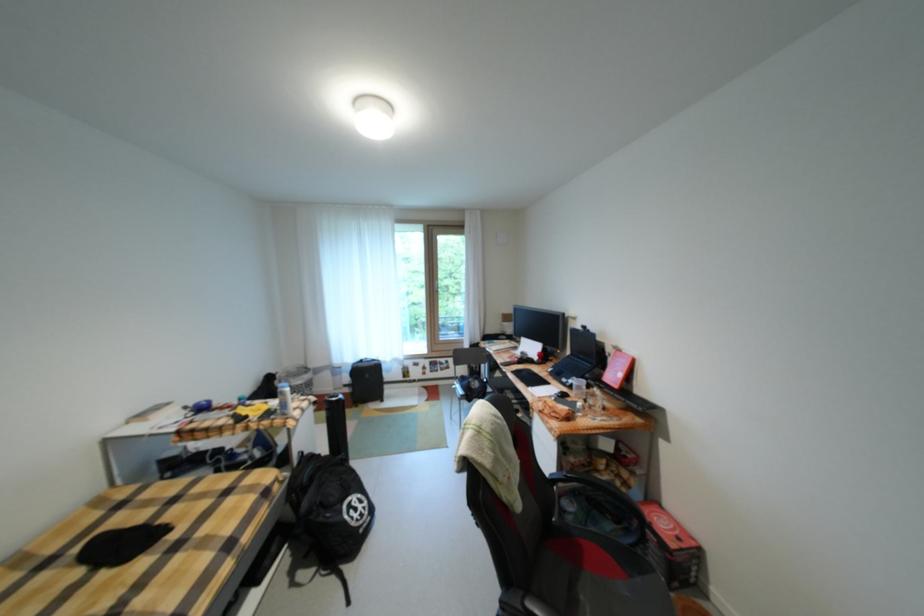
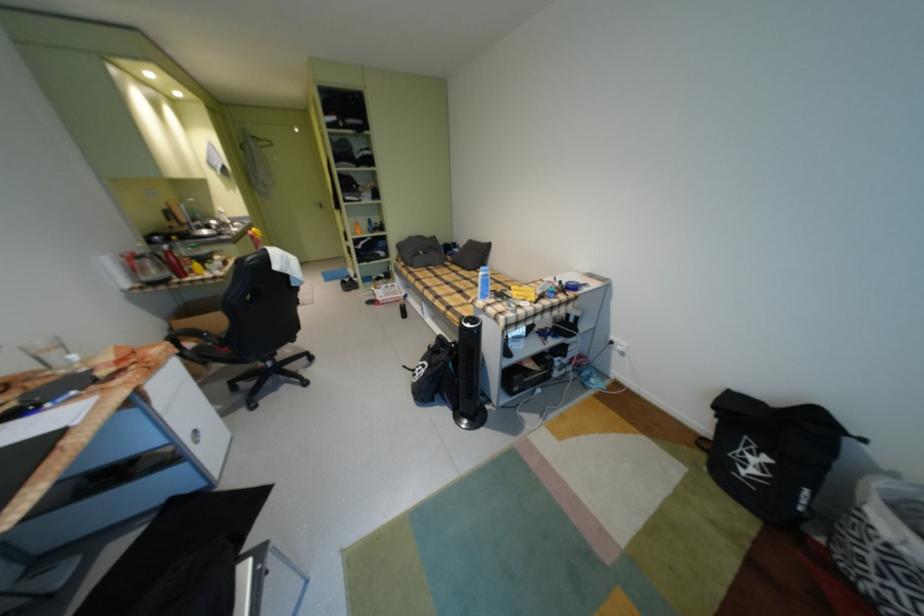
Question: I am providing you with two images of the same scene from different viewpoints. After the viewpoint changes to image2, which objects are now occluded?

Choices:
 (A) black chair seat
 (B) white laundry basket
 (C) chair armrest
 (D) none of these

Answer: (D)